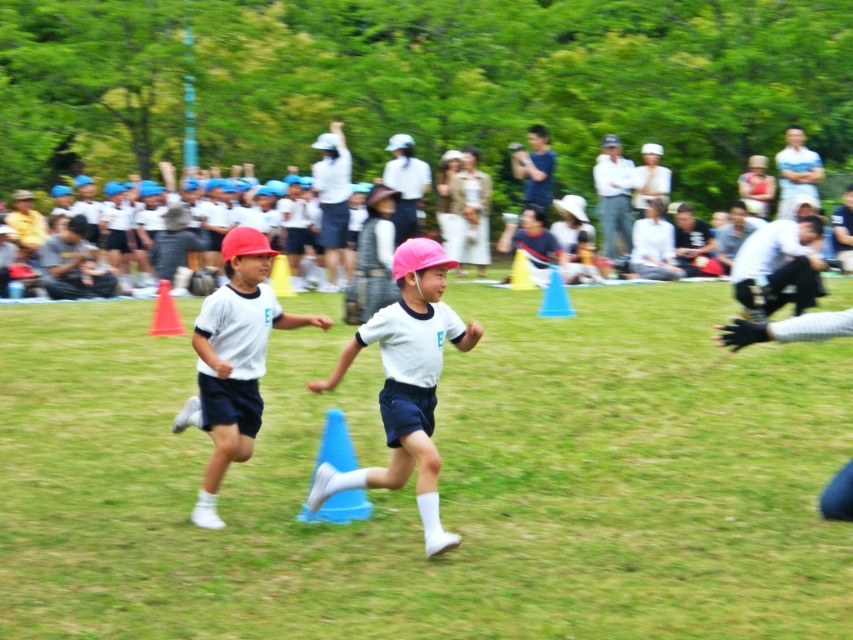
Question: Is white matte shirt at center wider than blue plastic cone at center?

Choices:
 (A) yes
 (B) no

Answer: (A)

Question: Which point appears closest to the camera in this image?

Choices:
 (A) (207, 474)
 (B) (334, 465)
 (C) (532, 577)
 (D) (42, 252)

Answer: (C)

Question: Which object is farther from the camera taking this photo?

Choices:
 (A) green grass at center
 (B) white matte shirt at center

Answer: (B)

Question: Estimate the real-world distances between objects in this image. Which object is farther from the white cotton crowd at upper center?

Choices:
 (A) white matte helmet at center
 (B) white matte shirt at center

Answer: (B)

Question: Can you confirm if green grass at center is positioned below blue plastic cone at center?

Choices:
 (A) no
 (B) yes

Answer: (A)

Question: Does green grass at center come behind blue plastic cone at center?

Choices:
 (A) yes
 (B) no

Answer: (B)